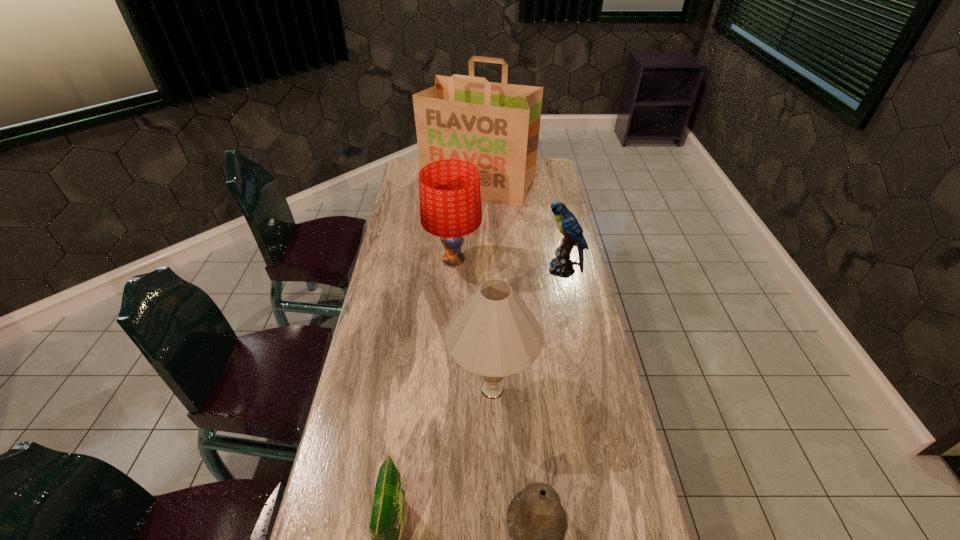
Locate an element on the screen. Image resolution: width=960 pixels, height=540 pixels. grocery bag is located at coordinates (495, 126).

At what (x,y) coordinates should I click in order to perform the action: click on the farthest object. Please return your answer as a coordinate pair (x, y). The width and height of the screenshot is (960, 540). Looking at the image, I should click on (495, 126).

I want to click on the nearer lampshade, so pos(494,334).

Find the location of a particular element. the farther lampshade is located at coordinates (450, 198).

Where is `parrot`? The height and width of the screenshot is (540, 960). parrot is located at coordinates (562, 266).

Where is `vacant space located 0.150m on the front of the tallest object`? The height and width of the screenshot is (540, 960). vacant space located 0.150m on the front of the tallest object is located at coordinates (479, 228).

Locate an element on the screen. vacant area situated 0.180m on the right of the fourth farthest object is located at coordinates (598, 389).

You are a GUI agent. You are given a task and a screenshot of the screen. Output one action in this format:
    pyautogui.click(x=<x>, y=<y>)
    Task: Click on the vacant region located 0.240m on the front-facing side of the farther lampshade
    The height and width of the screenshot is (540, 960).
    Given the screenshot: What is the action you would take?
    pyautogui.click(x=545, y=261)

Image resolution: width=960 pixels, height=540 pixels. What are the coordinates of `vacant area situated 0.220m on the face of the parrot` in the screenshot? It's located at (484, 270).

Find the location of a particular element. vacant area located on the face of the parrot is located at coordinates (494, 270).